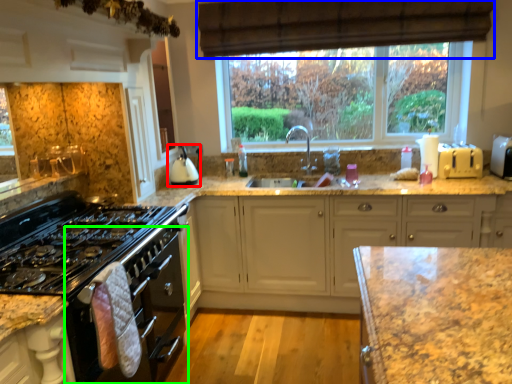
Question: Based on their relative distances, which object is nearer to kitchen appliance (highlighted by a red box)? Choose from curtain (highlighted by a blue box) and oven (highlighted by a green box).

Choices:
 (A) curtain
 (B) oven

Answer: (B)